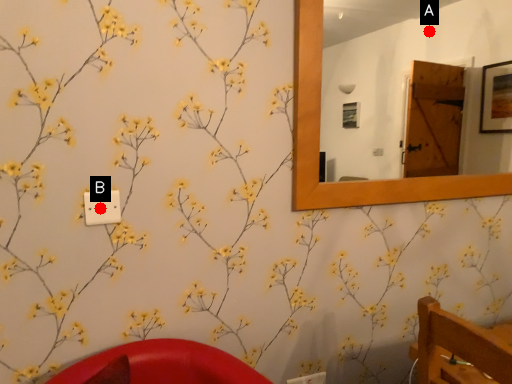
Question: Two points are circled on the image, labeled by A and B beside each circle. Which point appears closest to the camera in this image?

Choices:
 (A) A is closer
 (B) B is closer

Answer: (B)